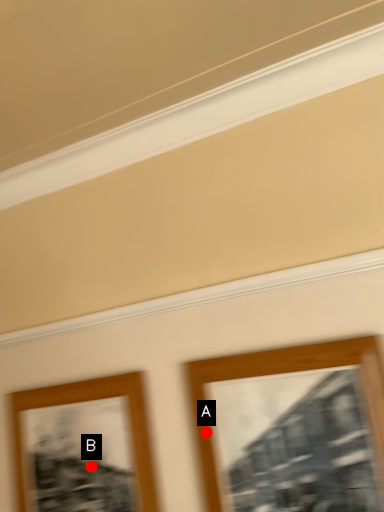
Question: Two points are circled on the image, labeled by A and B beside each circle. Which point is farther to the camera?

Choices:
 (A) A is further
 (B) B is further

Answer: (B)